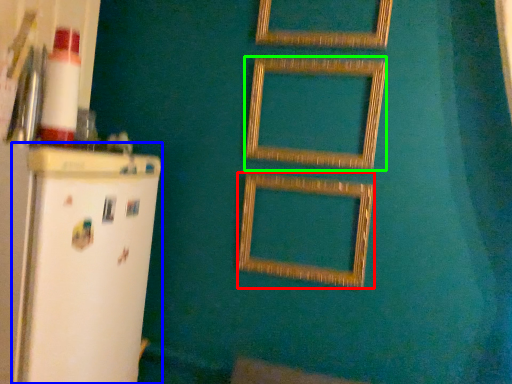
Question: Which object is the farthest from picture frame (highlighted by a red box)? Choose among these: fridge (highlighted by a blue box) or picture frame (highlighted by a green box).

Choices:
 (A) fridge
 (B) picture frame

Answer: (A)